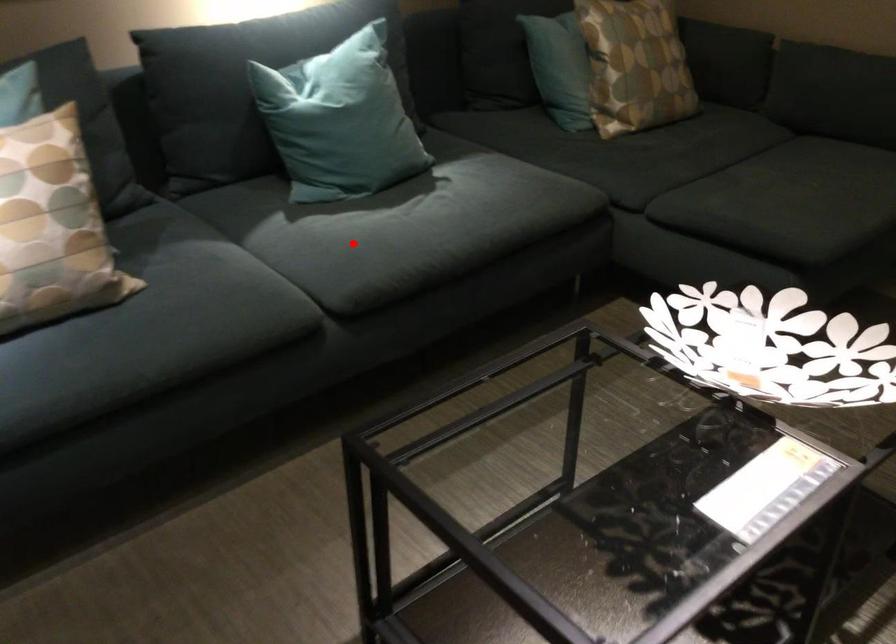
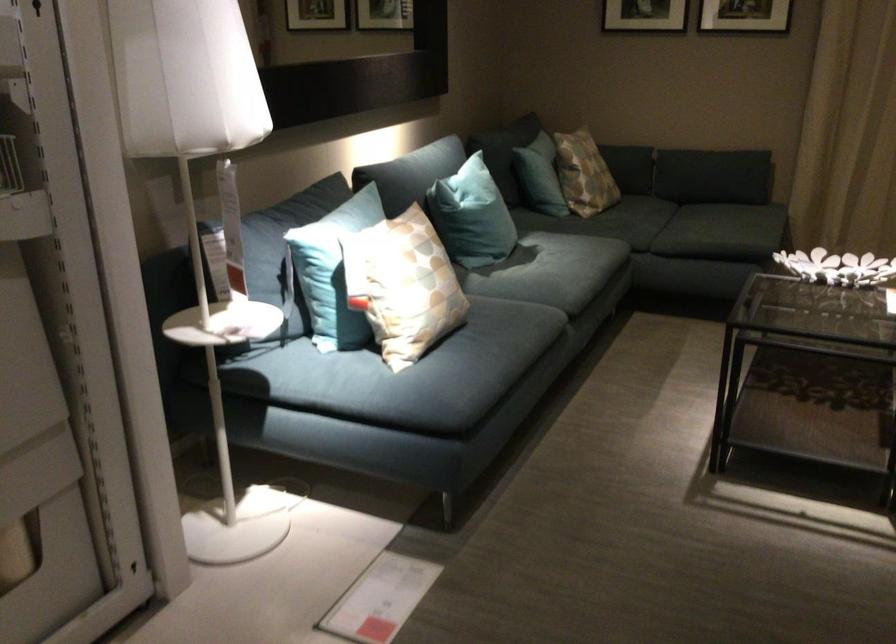
In the second image, find the point that corresponds to the highlighted location in the first image.

(552, 275)